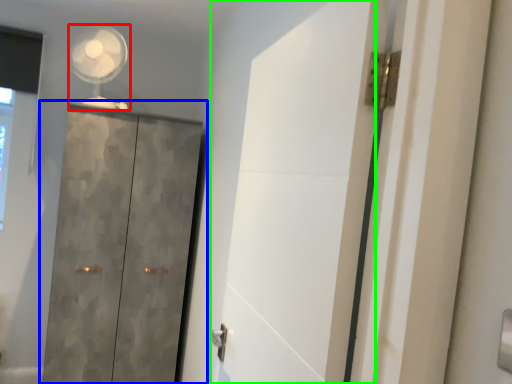
Question: Considering the real-world distances, which object is closest to mechanical fan (highlighted by a red box)? cupboard (highlighted by a blue box) or screen door (highlighted by a green box).

Choices:
 (A) cupboard
 (B) screen door

Answer: (A)